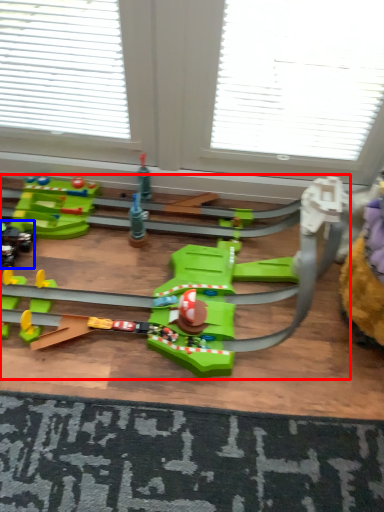
Question: Which point is further to the camera, toy (highlighted by a red box) or toy (highlighted by a blue box)?

Choices:
 (A) toy
 (B) toy

Answer: (B)